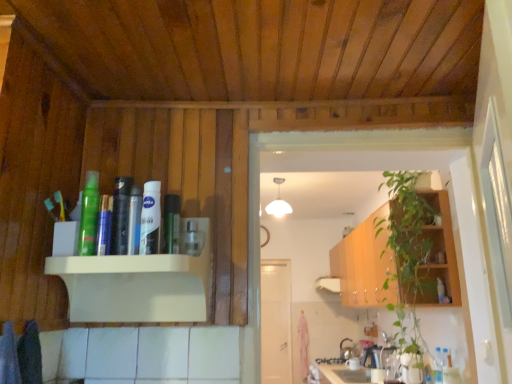
Question: From a real-world perspective, is green matte spray can at upper left, acting as the 1th toiletry starting from the left, located beneath green leafy plant at right?

Choices:
 (A) yes
 (B) no

Answer: (B)

Question: Is green matte spray can at upper left, which is the 3th toiletry from right to left, taller than green leafy plant at right?

Choices:
 (A) yes
 (B) no

Answer: (B)

Question: Considering the relative sizes of green matte spray can at upper left, acting as the 1th toiletry starting from the left, and green leafy plant at right in the image provided, is green matte spray can at upper left, acting as the 1th toiletry starting from the left, smaller than green leafy plant at right?

Choices:
 (A) yes
 (B) no

Answer: (A)

Question: Is green matte spray can at upper left, which is the 3th toiletry from right to left, outside green leafy plant at right?

Choices:
 (A) yes
 (B) no

Answer: (A)

Question: From the image's perspective, is green matte spray can at upper left, which is the 3th toiletry from right to left, on top of green leafy plant at right?

Choices:
 (A) no
 (B) yes

Answer: (B)

Question: Can you confirm if green matte spray can at upper left, which is the 3th toiletry from right to left, is positioned to the left of green leafy plant at right?

Choices:
 (A) no
 (B) yes

Answer: (B)

Question: From the image's perspective, is green matte spray can at upper left, which is the 3th toiletry from right to left, over green wood cabinet at right?

Choices:
 (A) yes
 (B) no

Answer: (A)

Question: Is green matte spray can at upper left, which is the 3th toiletry from right to left, not close to green wood cabinet at right?

Choices:
 (A) yes
 (B) no

Answer: (A)

Question: Does green matte spray can at upper left, acting as the 1th toiletry starting from the left, have a greater width compared to green wood cabinet at right?

Choices:
 (A) no
 (B) yes

Answer: (A)

Question: Can you confirm if green matte spray can at upper left, acting as the 1th toiletry starting from the left, is positioned to the right of green wood cabinet at right?

Choices:
 (A) yes
 (B) no

Answer: (B)

Question: From the image's perspective, does green matte spray can at upper left, acting as the 1th toiletry starting from the left, appear lower than green wood cabinet at right?

Choices:
 (A) yes
 (B) no

Answer: (B)

Question: Is green matte spray can at upper left, which is the 3th toiletry from right to left, oriented away from green wood cabinet at right?

Choices:
 (A) yes
 (B) no

Answer: (B)

Question: Considering the relative sizes of white matte door at center and white glossy nivea cream at upper center, acting as the 2th toiletry starting from the right, in the image provided, is white matte door at center taller than white glossy nivea cream at upper center, acting as the 2th toiletry starting from the right,?

Choices:
 (A) no
 (B) yes

Answer: (B)